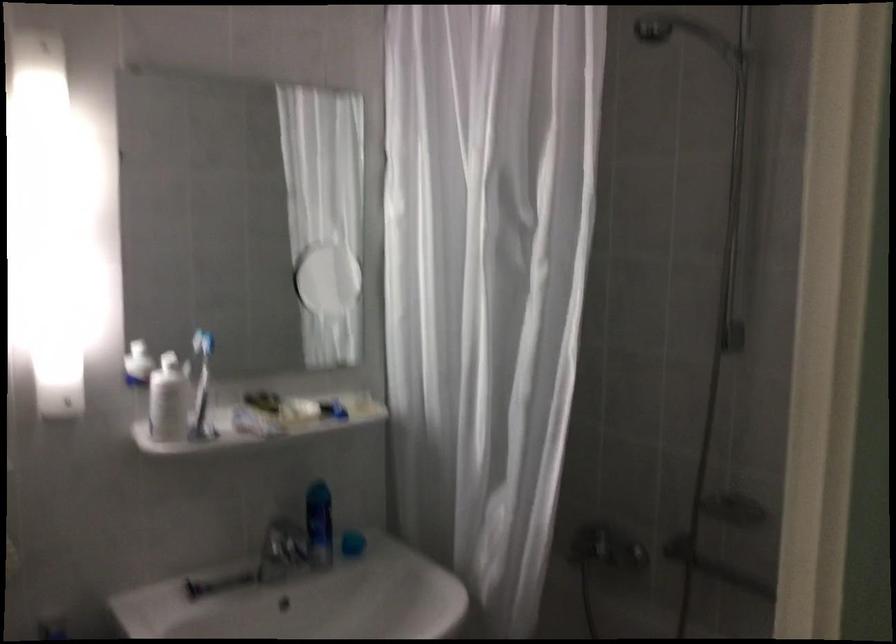
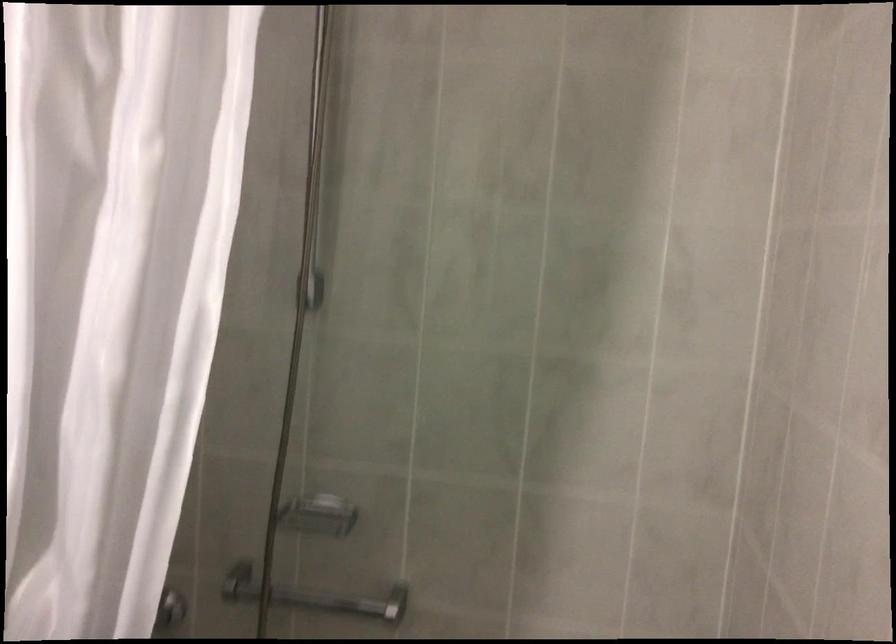
Question: The first image is from the beginning of the video and the second image is from the end. How did the camera likely rotate when shooting the video?

Choices:
 (A) Left
 (B) Right
 (C) Up
 (D) Down

Answer: (B)